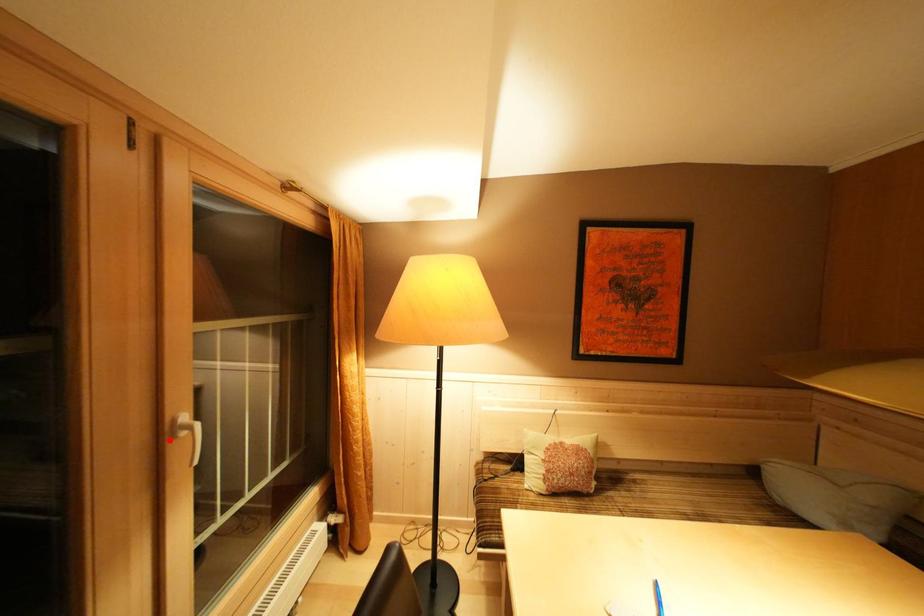
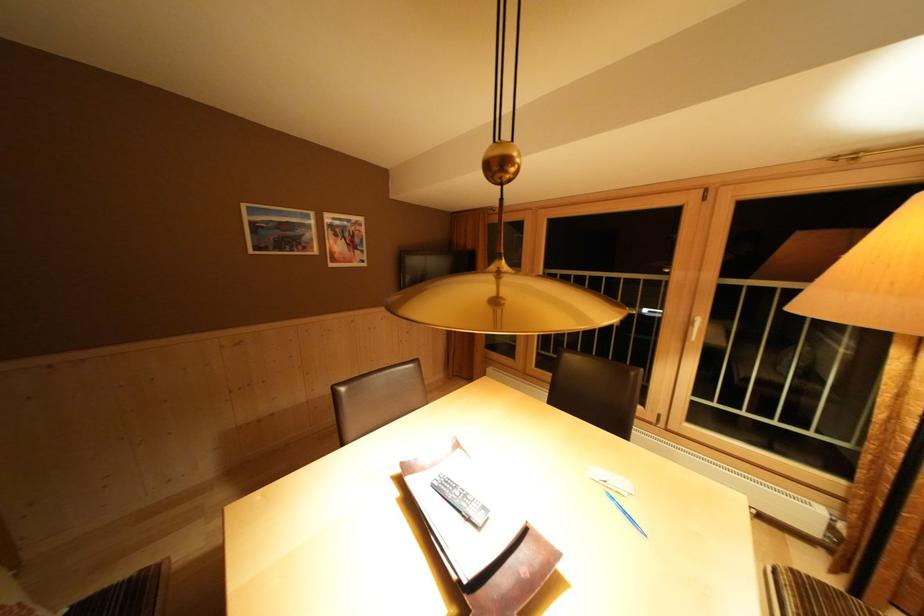
Find the pixel in the second image that matches the highlighted location in the first image.

(697, 328)